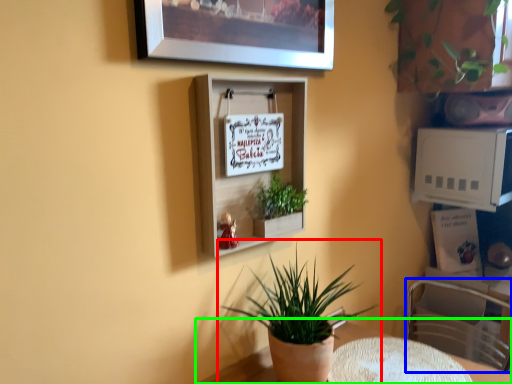
Question: Which object is the farthest from houseplant (highlighted by a red box)? Choose among these: swivel chair (highlighted by a blue box) or table (highlighted by a green box).

Choices:
 (A) swivel chair
 (B) table

Answer: (A)